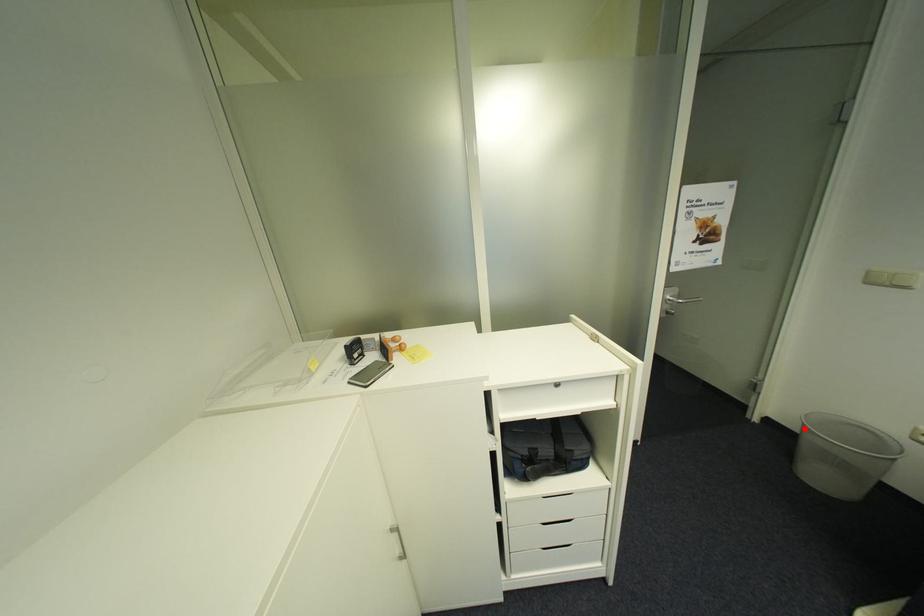
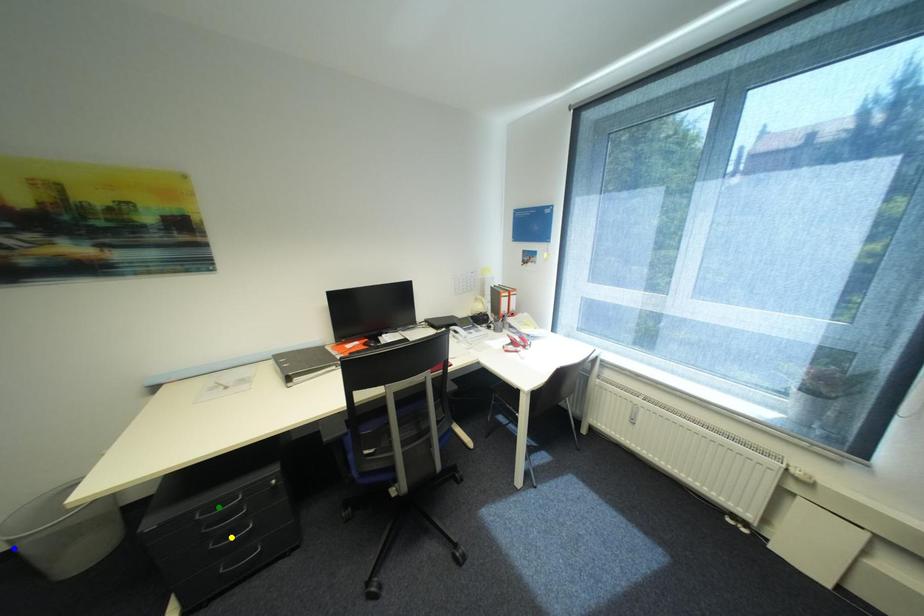
Question: I am providing you with two images of the same scene from different viewpoints. A red point is marked on the first image. You are given multiple points on the second image. Which mark in image 2 goes with the point in image 1?

Choices:
 (A) green point
 (B) blue point
 (C) yellow point

Answer: (B)